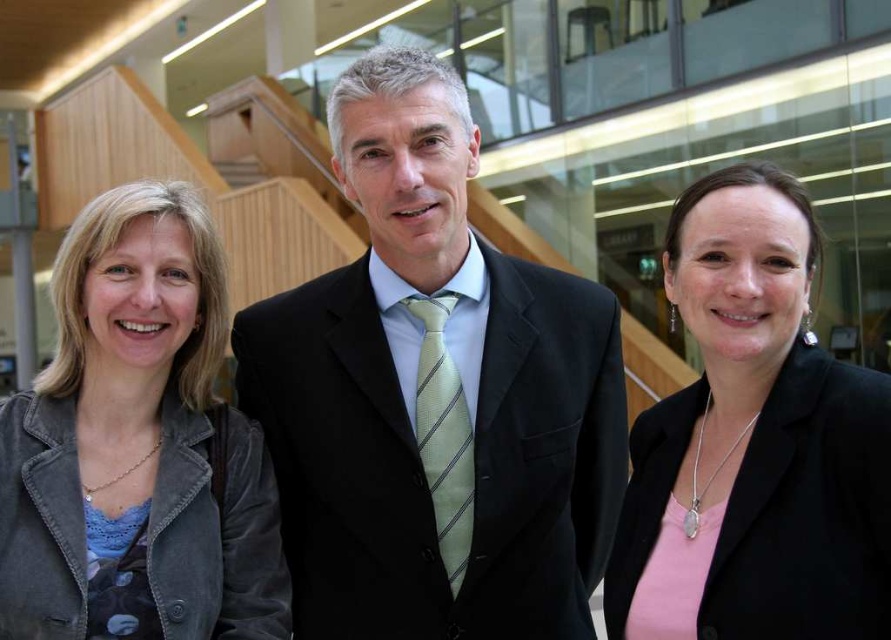
You are a photographer setting up for a group photo in an office. You notice the denim jacket at left and the pink matte blazer at center. Which clothing item is positioned higher in the frame?

The denim jacket at left is located above the pink matte blazer at center, so it is positioned higher in the frame.

You are standing in the office scene and want to place a small plant between the two points labeled as point (459, 83) and point (836, 604). Based on their positions, which point should the plant be closer to in order to be centrally located?

The plant should be closer to point (836, 604) because point (459, 83) is behind point (836, 604), so the central location would be nearer to the front point.